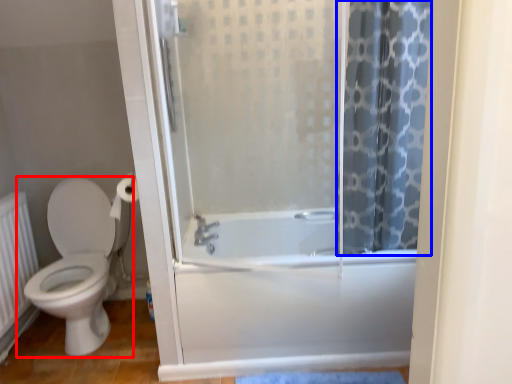
Question: Which point is further to the camera, toilet (highlighted by a red box) or shower curtain (highlighted by a blue box)?

Choices:
 (A) toilet
 (B) shower curtain

Answer: (A)